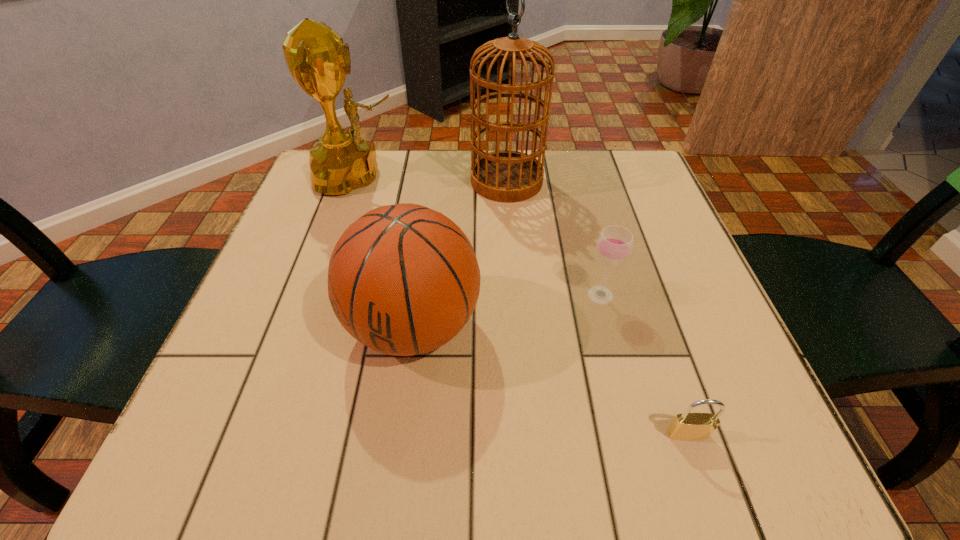
Locate an element on the screen. vacant region located 0.090m on the right of the fourth object from left to right is located at coordinates (665, 295).

The width and height of the screenshot is (960, 540). Find the location of `birdcage situated at the far edge`. birdcage situated at the far edge is located at coordinates [x=508, y=176].

This screenshot has width=960, height=540. I want to click on award that is at the far edge, so click(318, 60).

Find the location of a particular element. object at the near edge is located at coordinates (687, 426).

The image size is (960, 540). I want to click on object present at the left edge, so click(x=318, y=60).

This screenshot has width=960, height=540. Identify the location of object that is positioned at the right edge. (687, 426).

What are the coordinates of `object located at the far left corner` in the screenshot? It's located at (318, 60).

Find the location of a particular element. The image size is (960, 540). object that is at the near right corner is located at coordinates (687, 426).

In the image, there is a desktop. Find the location of `vacant space at the far edge`. vacant space at the far edge is located at coordinates (452, 154).

The width and height of the screenshot is (960, 540). What are the coordinates of `vacant region at the near edge of the desktop` in the screenshot? It's located at [411, 444].